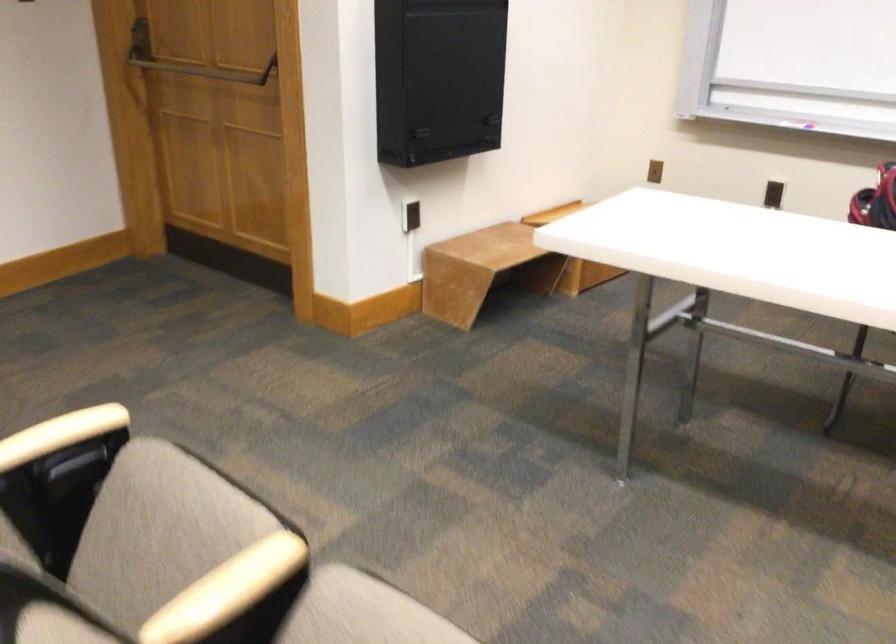
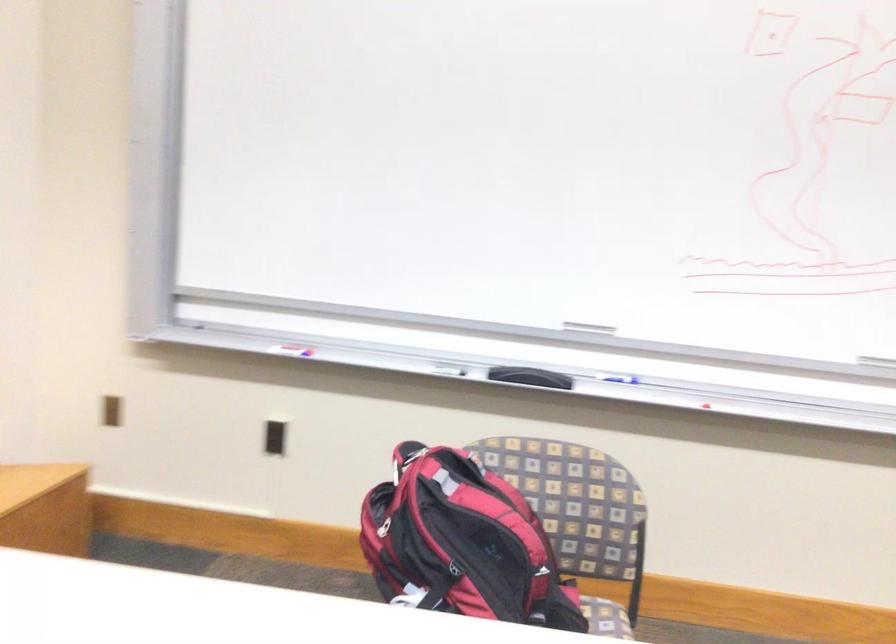
Find the pixel in the second image that matches point (808, 100) in the first image.

(288, 345)